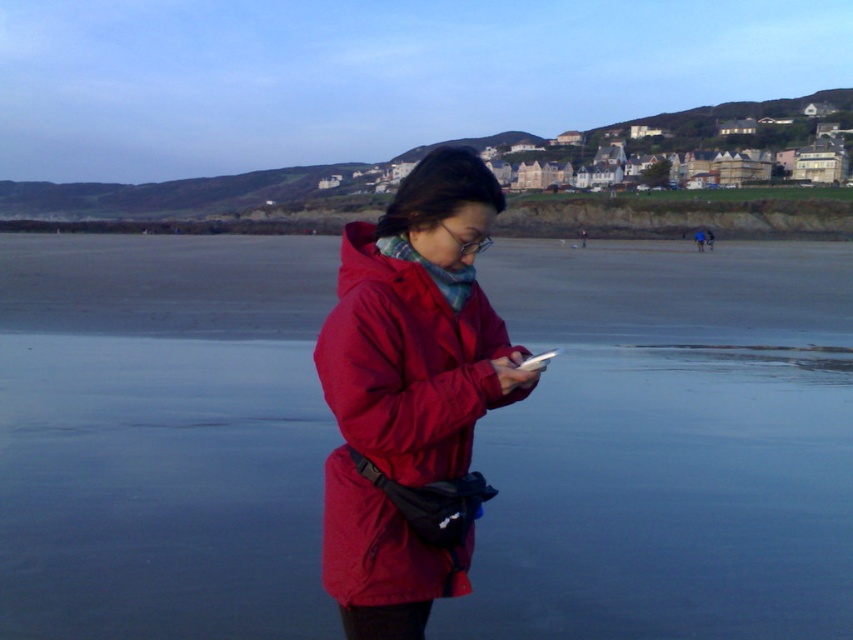
Looking at this image, you are a photographer trying to capture the person in the matte red jacket at center without including the transparent water at center in the frame. Based on their sizes, is this possible?

The transparent water at center has a larger size compared to the matte red jacket at center, so it might be challenging to exclude the transparent water at center from the frame if the jacket is positioned centrally. Adjusting the camera angle or zoom could help isolate the jacket.

You are a photographer trying to capture a silhouette of the person wearing the matte red jacket at center against the transparent water at center. Given the lighting conditions, will the silhouette be clearly visible?

The transparent water at center is much taller than the matte red jacket at center, so the silhouette of the matte red jacket at center will be clearly visible against the transparent water at center due to the height difference creating a distinct contrast.

You are a drone operator trying to capture the best aerial shot of the beach. The transparent water at center is located at point [666,448]. Where should you position your drone to ensure it captures the transparent water at center in the frame?

The transparent water at center is located at point [666,448], so the drone should be positioned directly above this point to capture it in the frame.